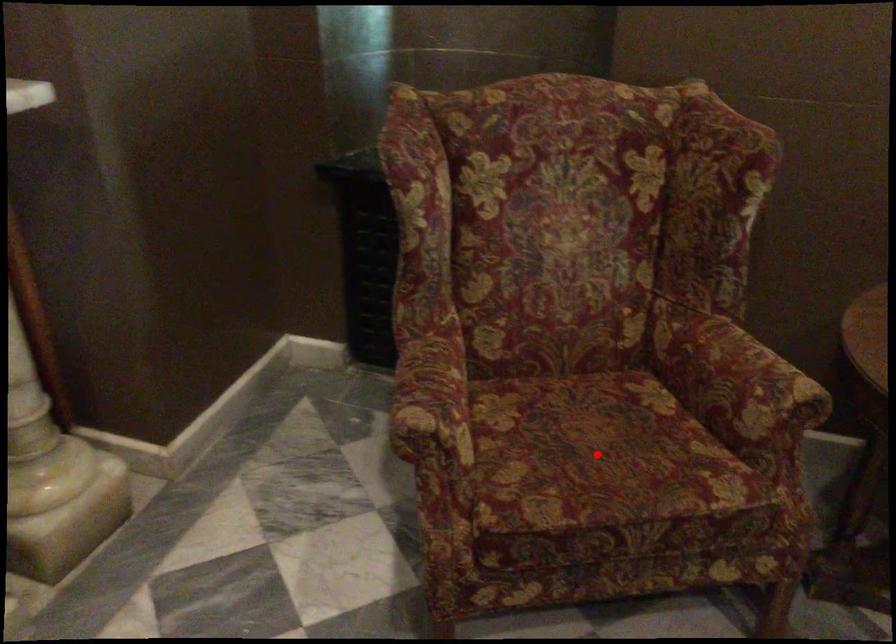
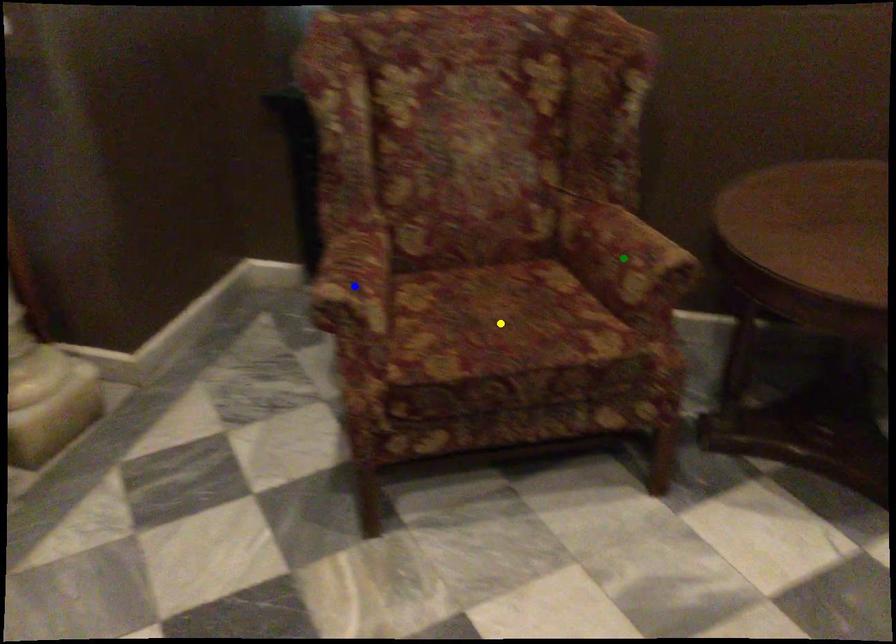
Question: I am providing you with two images of the same scene from different viewpoints. A red point is marked on the first image. You are given multiple points on the second image. In image 2, which mark is for the same physical point as the one in image 1?

Choices:
 (A) blue point
 (B) yellow point
 (C) green point

Answer: (B)